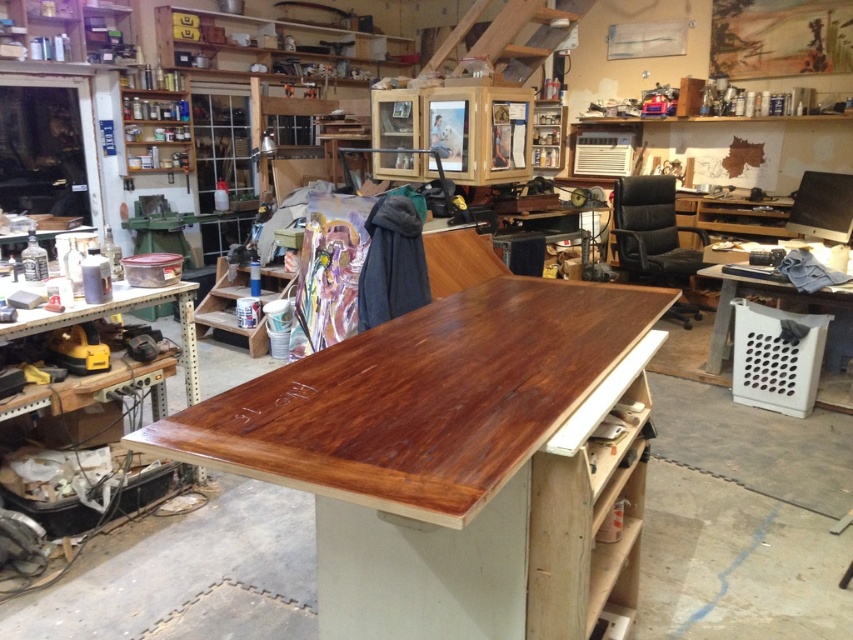
Can you confirm if shiny wood table at center is smaller than wooden workbench at left?

Incorrect, shiny wood table at center is not smaller in size than wooden workbench at left.

Who is more forward, [509,288] or [103,308]?

Positioned in front is point [509,288].

The image size is (853, 640). I want to click on shiny wood table at center, so [x=451, y=458].

Who is taller, shiny wood table at center or wooden crate at lower right?

With more height is shiny wood table at center.

Is shiny wood table at center shorter than wooden crate at lower right?

No.

I want to click on shiny wood table at center, so click(451, 458).

This screenshot has width=853, height=640. Find the location of `shiny wood table at center`. shiny wood table at center is located at coordinates (451, 458).

Between wooden workbench at left and wooden crate at lower right, which one appears on the left side from the viewer's perspective?

From the viewer's perspective, wooden workbench at left appears more on the left side.

Between wooden workbench at left and wooden crate at lower right, which one is positioned higher?

wooden crate at lower right is higher up.

Is point (112, 301) positioned in front of point (804, 294)?

Yes, it is.

Where is `wooden workbench at left`? Image resolution: width=853 pixels, height=640 pixels. wooden workbench at left is located at coordinates (122, 312).